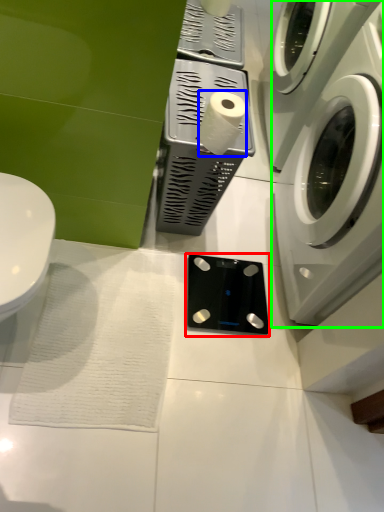
Question: Which is nearer to the appliance (highlighted by a red box)? toilet paper (highlighted by a blue box) or washing machine (highlighted by a green box).

Choices:
 (A) toilet paper
 (B) washing machine

Answer: (B)